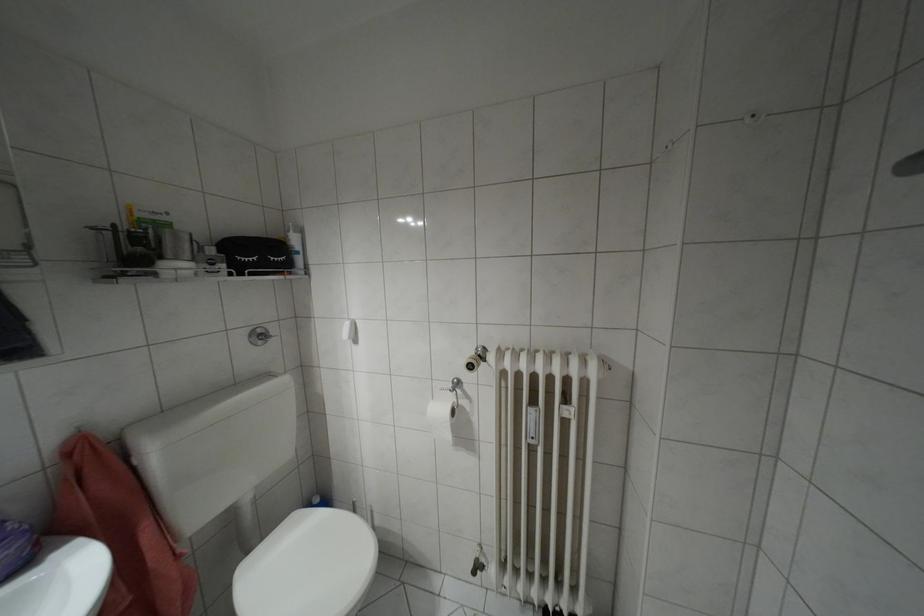
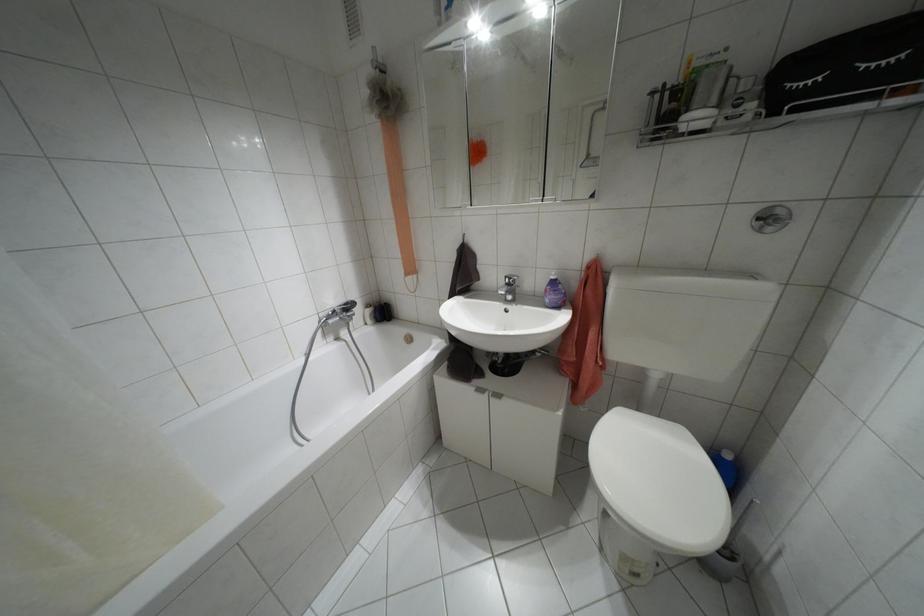
The point at (260, 341) is marked in the first image. Where is the corresponding point in the second image?

(769, 228)